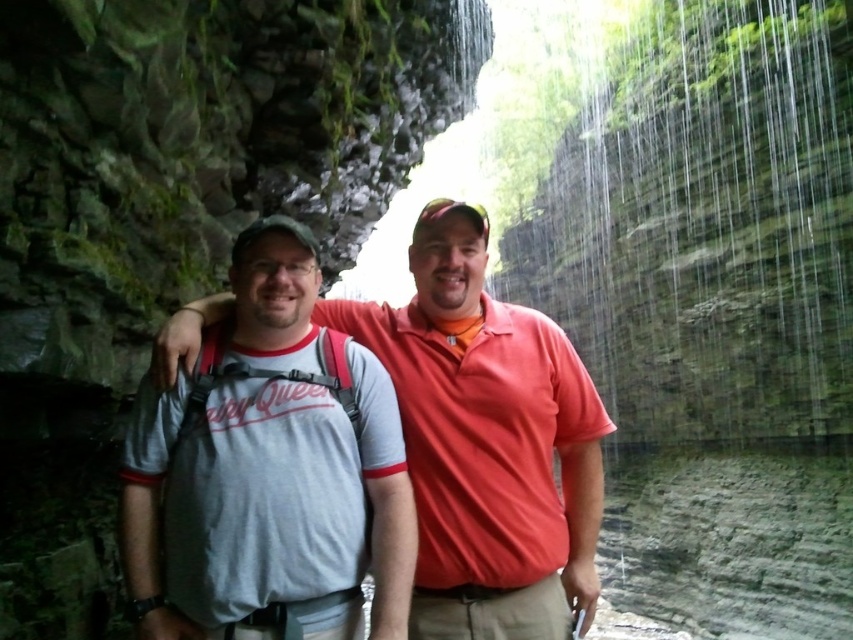
Who is positioned more to the right, green mossy rock at upper center or gray cotton t-shirt at center?

green mossy rock at upper center

Which is behind, point (695, 109) or point (329, 513)?

Point (695, 109)

Image resolution: width=853 pixels, height=640 pixels. I want to click on green mossy rock at upper center, so click(706, 227).